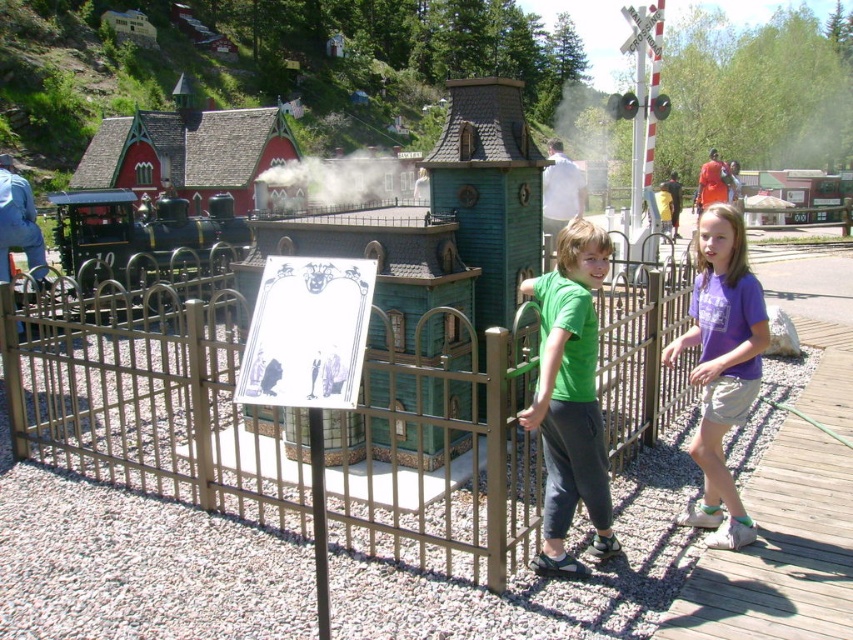
You are a photographer positioned at the center of the scene. You want to take a photo that includes both the purple cotton shirt at right and the white smoke at center. Which direction should you move to ensure both subjects are in frame?

Since the purple cotton shirt at right is to the right of the white smoke at center, you should move to the right to include both the purple cotton shirt at right and the white smoke at center in your photo.

You are standing at the center of the scene. There is a point marked at coordinates (722, 365). Which object is located at that point?

The point at coordinates (722, 365) marks the purple cotton shirt at right.